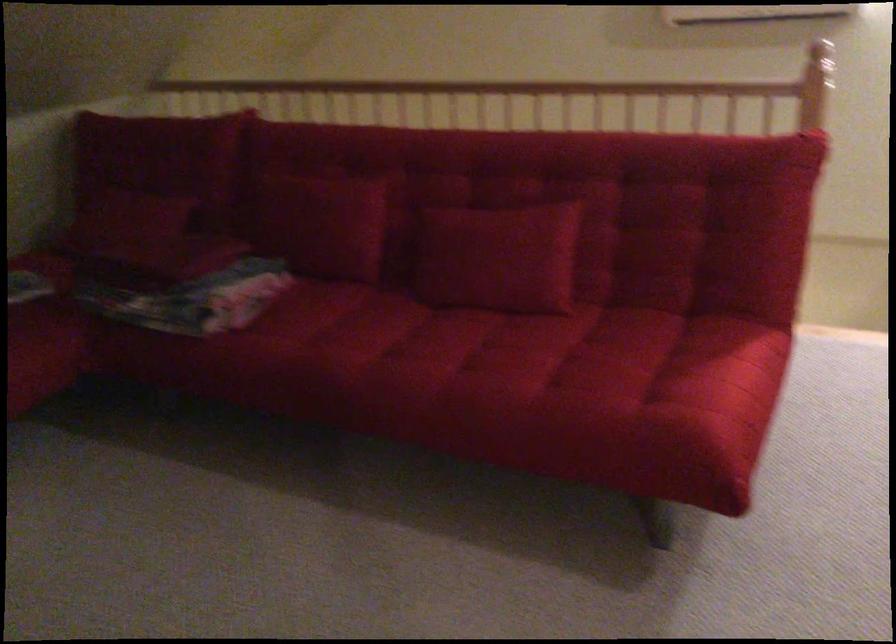
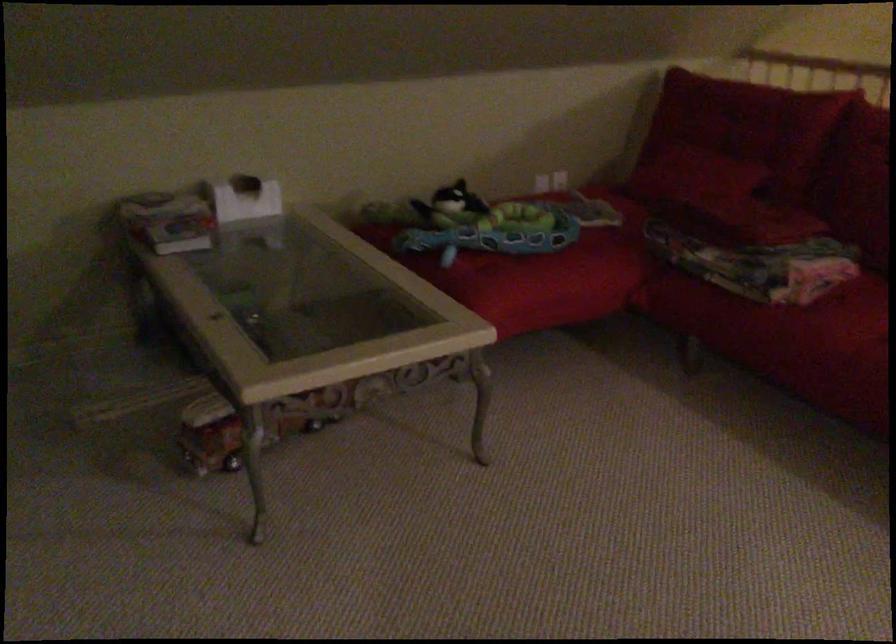
Locate, in the second image, the point that corresponds to pixel 178 265 in the first image.

(761, 220)